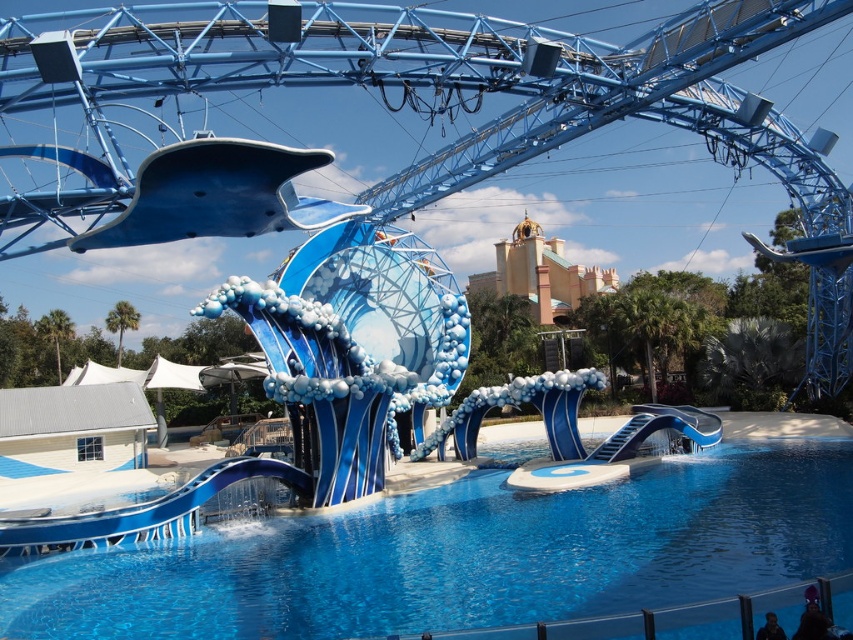
You are a parent trying to decide which attraction to take your child to first. The glossy blue whale at upper center and the glossy plastic slide at lower left are both visible from where you stand. Based on their sizes, which one would you estimate is more likely to be a rideable attraction?

The glossy blue whale at upper center is bigger than the glossy plastic slide at lower left, so it is more likely to be the rideable attraction since larger structures often accommodate more passengers or have more features for interaction.

You are a maintenance worker needing to inspect both the transparent glass pool at center and the glossy plastic slide at lower left. You have a remote control drone that can travel 15 meters. Starting from the slide, can you reach the pool without needing to recharge the drone?

The distance between the transparent glass pool at center and the glossy plastic slide at lower left is 13.37 meters. Since the drone can travel 15 meters, which is more than the required distance, the drone can reach the pool without needing to recharge.

You are a maintenance worker needing to clean the transparent glass pool at center and the glossy blue whale at upper center. Which object requires a wider cleaning tool? Please base your answer on their sizes.

The transparent glass pool at center might be wider than glossy blue whale at upper center, so you should use a wider cleaning tool for the transparent glass pool at center.